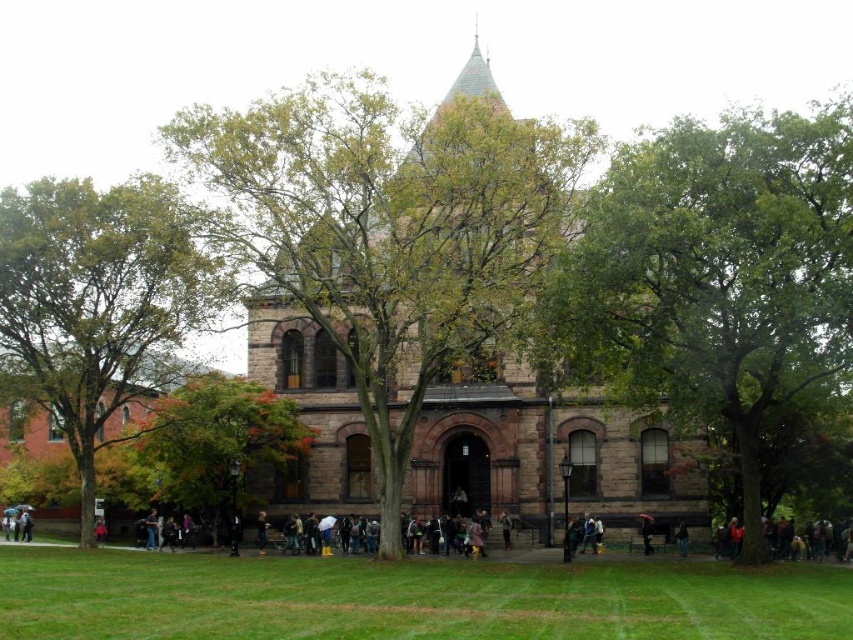
Question: Which object is closer to the camera taking this photo?

Choices:
 (A) dark blue jeans at lower center
 (B) dark blue jeans at lower left

Answer: (A)

Question: Considering the relative positions of brown stone church at center and dark blue jeans at lower left in the image provided, where is brown stone church at center located with respect to dark blue jeans at lower left?

Choices:
 (A) above
 (B) below

Answer: (A)

Question: Is green leafy tree at center positioned behind dark blue jeans at lower center?

Choices:
 (A) yes
 (B) no

Answer: (B)

Question: Which of the following is the farthest from the observer?

Choices:
 (A) autumn leaves at lower left
 (B) brown stone church at center
 (C) dark blue jeans at lower center
 (D) dark blue jeans at lower left

Answer: (D)

Question: Does green leafy tree at lower left have a lesser width compared to dark blue jeans at lower left?

Choices:
 (A) yes
 (B) no

Answer: (B)

Question: Which object is farther from the camera taking this photo?

Choices:
 (A) green leafy tree at lower left
 (B) autumn leaves at lower left
 (C) green leafy tree at center
 (D) dark brown leather jacket at center

Answer: (A)